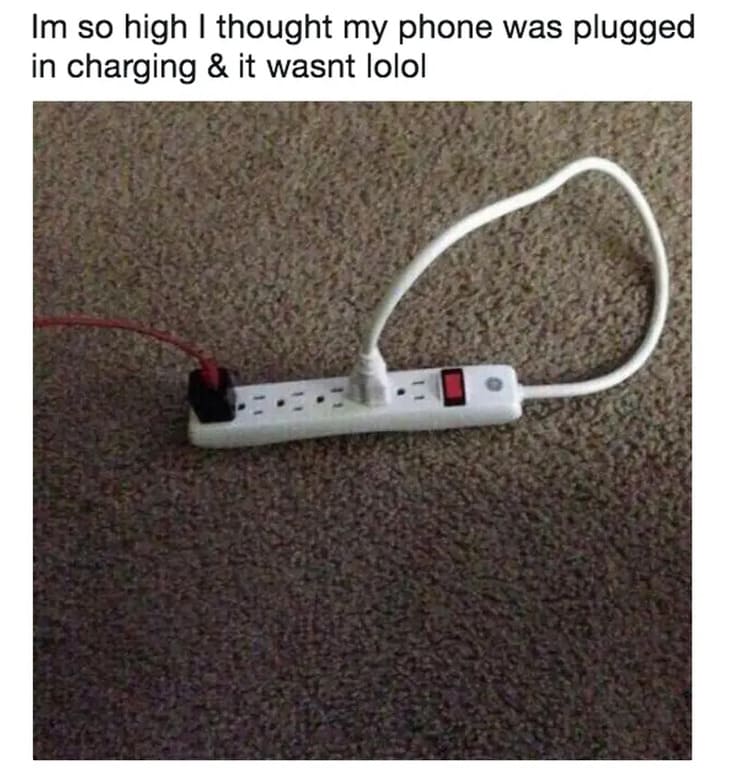
In order to click on surge protector in this screenshot , I will do `click(498, 383)`.